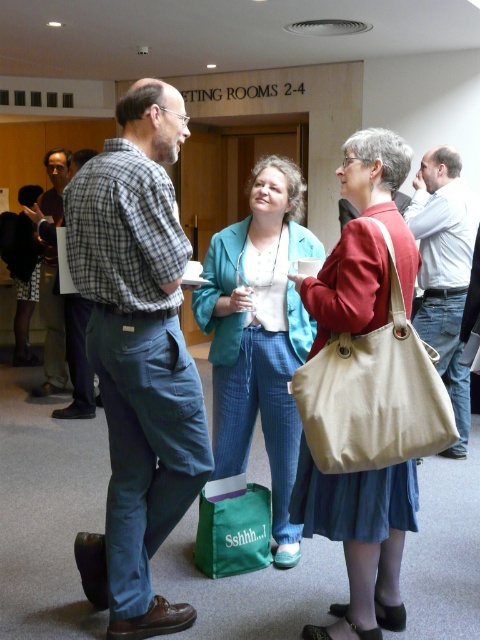
Question: Does canvas tote bag at center appear on the right side of matte black jacket at left?

Choices:
 (A) no
 (B) yes

Answer: (B)

Question: Which object is farther from the camera taking this photo?

Choices:
 (A) plaid cotton shirt at center
 (B) plaid shirt at left

Answer: (B)

Question: Does teal fabric jacket at center have a larger size compared to green canvas bag at lower center?

Choices:
 (A) yes
 (B) no

Answer: (A)

Question: Which point is closer to the camera?

Choices:
 (A) (276, 499)
 (B) (344, 275)
 (C) (455, 404)

Answer: (B)

Question: Does canvas tote bag at center have a lesser width compared to teal fabric jacket at center?

Choices:
 (A) no
 (B) yes

Answer: (B)

Question: Estimate the real-world distances between objects in this image. Which object is farther from the matte black jacket at left?

Choices:
 (A) plaid cotton shirt at center
 (B) teal fabric jacket at center
 (C) green canvas bag at lower center

Answer: (A)